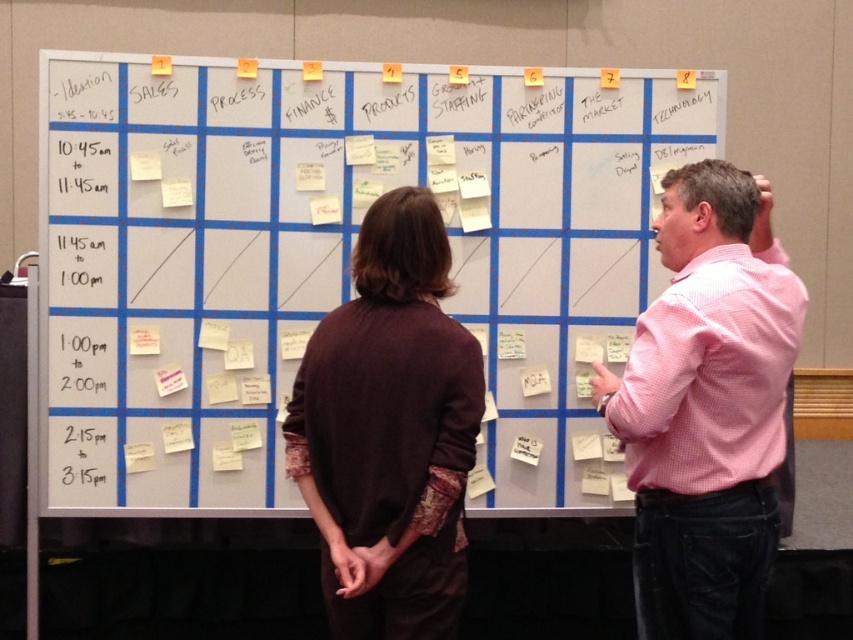
Question: Is pink checkered shirt at upper right thinner than pink checkered shirt at right?

Choices:
 (A) no
 (B) yes

Answer: (A)

Question: Which point appears closest to the camera in this image?

Choices:
 (A) (285, 157)
 (B) (750, 515)

Answer: (B)

Question: Which object is closer to the camera taking this photo?

Choices:
 (A) brown wool sweater at center
 (B) white paperboard at center

Answer: (A)

Question: Can you confirm if white paperboard at center is positioned to the left of brown wool sweater at center?

Choices:
 (A) yes
 (B) no

Answer: (A)

Question: Based on their relative distances, which object is nearer to the white paperboard at center?

Choices:
 (A) pink checkered shirt at upper right
 (B) brown wool sweater at center
 (C) pink checkered shirt at right

Answer: (B)

Question: Can you confirm if white paperboard at center is bigger than brown wool sweater at center?

Choices:
 (A) no
 (B) yes

Answer: (B)